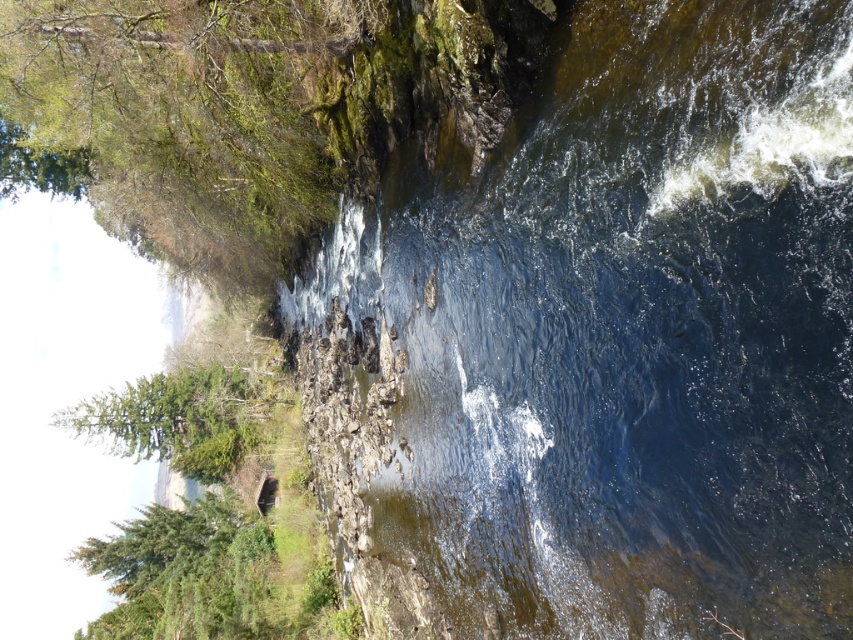
You are standing at the edge of the river and want to place a small decorative rock at each of the two points mentioned. Which point, point (200,602) or point (119,438), is closer to you where you can place the rock without needing to move further away?

Point (200,602) is closer to the viewer than point (119,438), so you can place the rock there without moving further away.

You are standing on the rocky shoreline and want to plant a new green matte tree between the green matte tree at lower left and the green matte tree at left. Considering their widths, which tree should you place the new tree closer to?

Since the green matte tree at lower left is wider than the green matte tree at left, you should place the new tree closer to the narrower green matte tree at left to maintain balance.

What is the 2D coordinate of the clear water at center in the image?

A: The clear water at center is located at the 2D coordinate point of (625, 336).